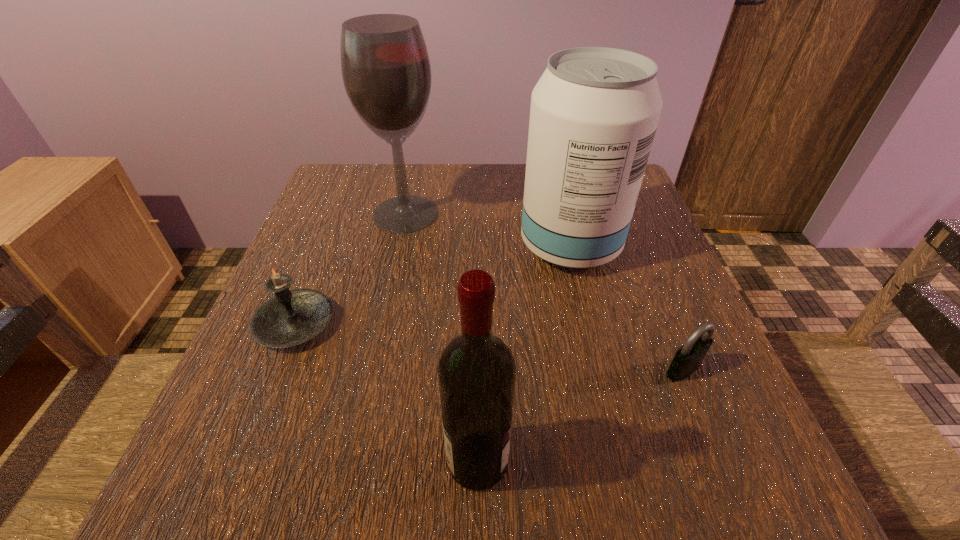
I want to click on free space between the padlock and the leftmost alcohol, so click(x=544, y=292).

At what (x,y) coordinates should I click in order to perform the action: click on vacant space that is in between the leftmost alcohol and the second alcohol from right to left. Please return your answer as a coordinate pair (x, y). This screenshot has width=960, height=540. Looking at the image, I should click on (442, 338).

Locate an element on the screen. The height and width of the screenshot is (540, 960). empty space that is in between the second nearest object and the rightmost alcohol is located at coordinates (x=627, y=308).

Locate an element on the screen. This screenshot has width=960, height=540. empty location between the rightmost alcohol and the fourth object from right to left is located at coordinates (488, 230).

This screenshot has width=960, height=540. In order to click on the fourth closest object to the rightmost alcohol in this screenshot , I will do pos(292,317).

Identify which object is located as the fourth nearest to the leftmost alcohol. Please provide its 2D coordinates. Your answer should be formatted as a tuple, i.e. [(x, y)], where the tuple contains the x and y coordinates of a point satisfying the conditions above.

[(688, 358)]

Locate an element on the screen. This screenshot has height=540, width=960. alcohol that is the nearest to the second object from left to right is located at coordinates (594, 112).

Where is `alcohol that stands as the second closest to the rightmost alcohol`? The height and width of the screenshot is (540, 960). alcohol that stands as the second closest to the rightmost alcohol is located at coordinates (476, 372).

Where is `vacant region that satisfies the following two spatial constraints: 1. on the front side of the shortest object; 2. on the front and back of the nearest object`? This screenshot has height=540, width=960. vacant region that satisfies the following two spatial constraints: 1. on the front side of the shortest object; 2. on the front and back of the nearest object is located at coordinates (720, 461).